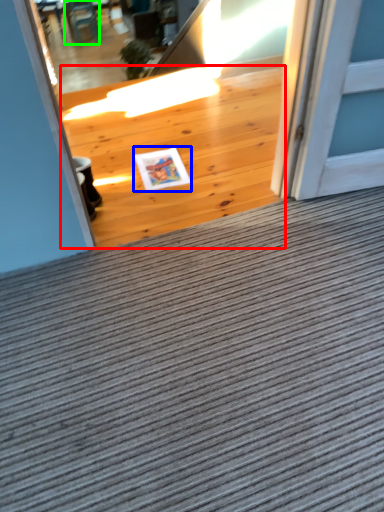
Question: Which object is positioned closest to hardwood (highlighted by a red box)? Select from postcard (highlighted by a blue box) and chair (highlighted by a green box).

Choices:
 (A) postcard
 (B) chair

Answer: (A)